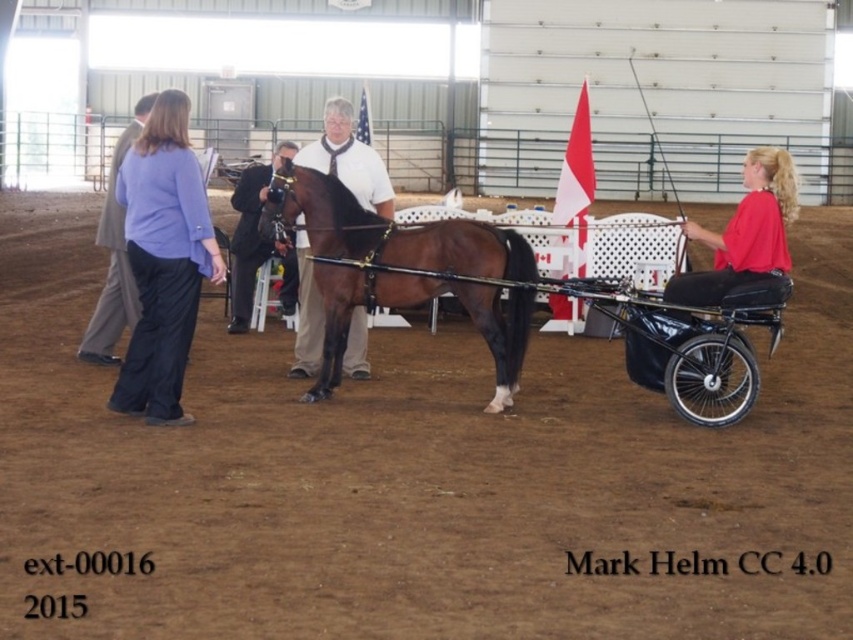
You are at the indoor equestrian event and see the point marked at coordinates (163, 260). What object is this point located on?

The point at (163, 260) is located on the purple fabric pants at left.

You are a photographer positioned at the back of the arena. You want to capture a photo of the person in the white glossy shirt at center and dark suit at center. Which clothing item will appear higher in the photo?

The white glossy shirt at center is located above the dark suit at center, so it will appear higher in the photo.

You are standing in the indoor equestrian event arena and want to place a small decoration between the two points, point (311, 276) and point (273, 154). Which point should the decoration be closer to in order to be nearer to the front of the arena?

The decoration should be closer to point (311, 276) because it is nearer to the viewer than point (273, 154).